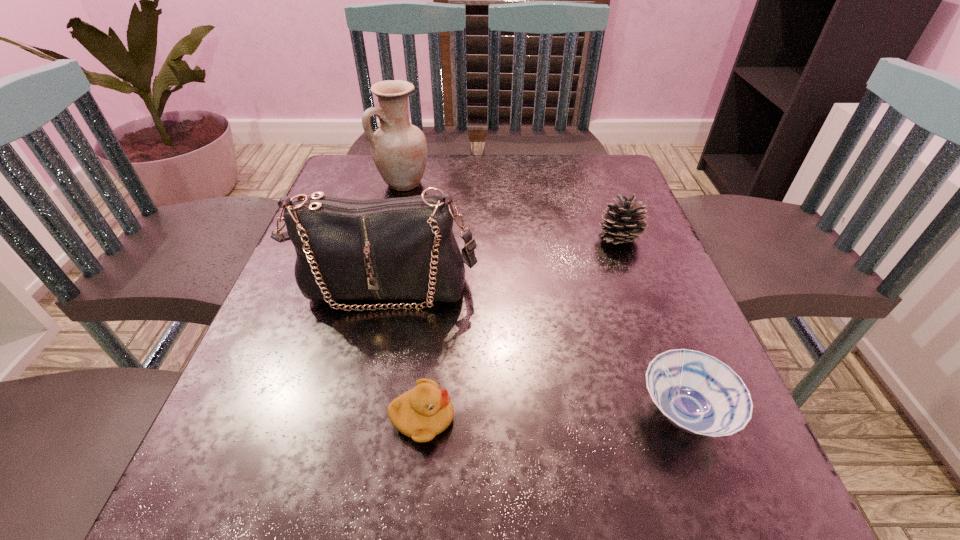
Where is `vacant area that lies between the handbag and the second shortest object`? vacant area that lies between the handbag and the second shortest object is located at coordinates (404, 353).

Image resolution: width=960 pixels, height=540 pixels. In order to click on free area in between the soup bowl and the duckling in this screenshot , I will do `click(553, 416)`.

Locate an element on the screen. The height and width of the screenshot is (540, 960). free space between the shortest object and the third nearest object is located at coordinates (535, 350).

The image size is (960, 540). In order to click on object that can be found as the second closest to the shortest object in this screenshot , I will do `click(425, 411)`.

Where is `object that is the third closest to the shortest object`? The height and width of the screenshot is (540, 960). object that is the third closest to the shortest object is located at coordinates (623, 221).

At what (x,y) coordinates should I click in order to perform the action: click on vacant space that satisfies the following two spatial constraints: 1. on the front side of the soup bowl; 2. on the left side of the farthest object. Please return your answer as a coordinate pair (x, y). The image size is (960, 540). Looking at the image, I should click on 348,413.

Where is `free space in the image that satisfies the following two spatial constraints: 1. on the front side of the shortest object; 2. at the beak of the duckling`? Image resolution: width=960 pixels, height=540 pixels. free space in the image that satisfies the following two spatial constraints: 1. on the front side of the shortest object; 2. at the beak of the duckling is located at coordinates (686, 418).